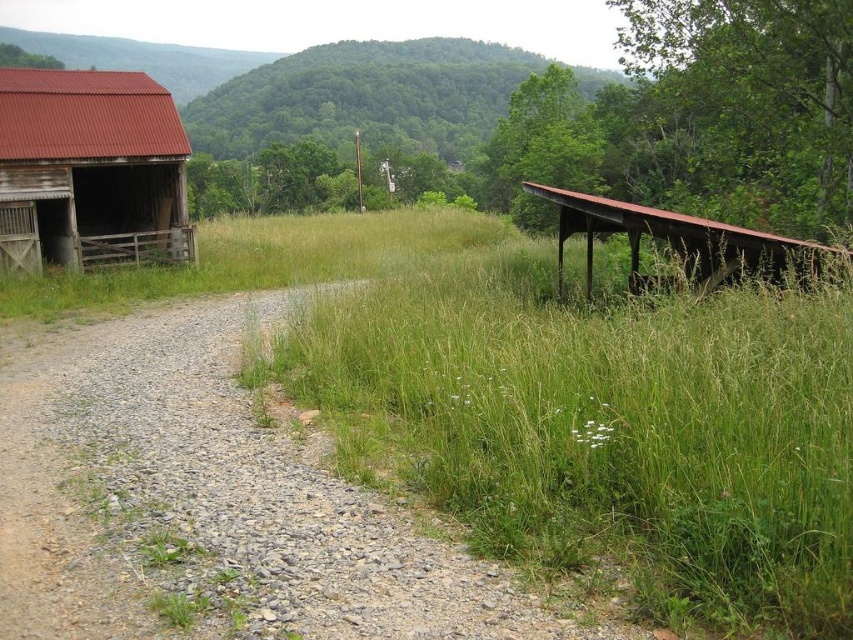
Question: Which of the following is the farthest from the observer?

Choices:
 (A) green leafy hillside at upper center
 (B) gray gravel at lower left
 (C) rusty corrugated metal barn at left

Answer: (A)

Question: In this image, where is gray gravel at lower left located relative to green leafy hillside at upper center?

Choices:
 (A) above
 (B) below

Answer: (B)

Question: Does green grassy at center have a lesser width compared to gray gravel at lower left?

Choices:
 (A) no
 (B) yes

Answer: (B)

Question: Which point is closer to the camera?

Choices:
 (A) rusty metal shelter at right
 (B) gray gravel at lower left
 (C) rusty corrugated metal barn at left

Answer: (B)

Question: Among these points, which one is farthest from the camera?

Choices:
 (A) (679, 458)
 (B) (561, 244)
 (C) (405, 112)
 (D) (605, 627)

Answer: (C)

Question: Is green leafy hillside at upper center to the left of rusty metal shelter at right from the viewer's perspective?

Choices:
 (A) yes
 (B) no

Answer: (A)